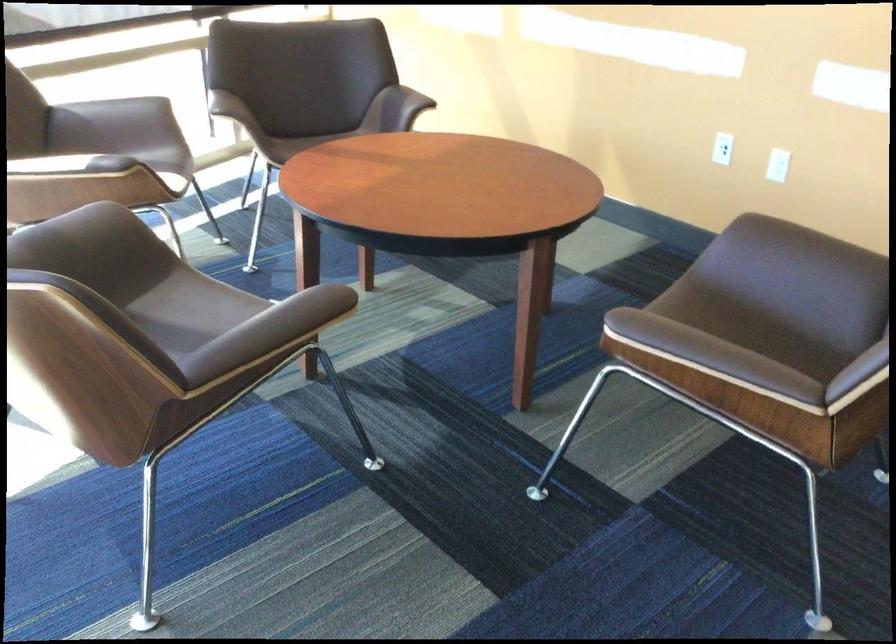
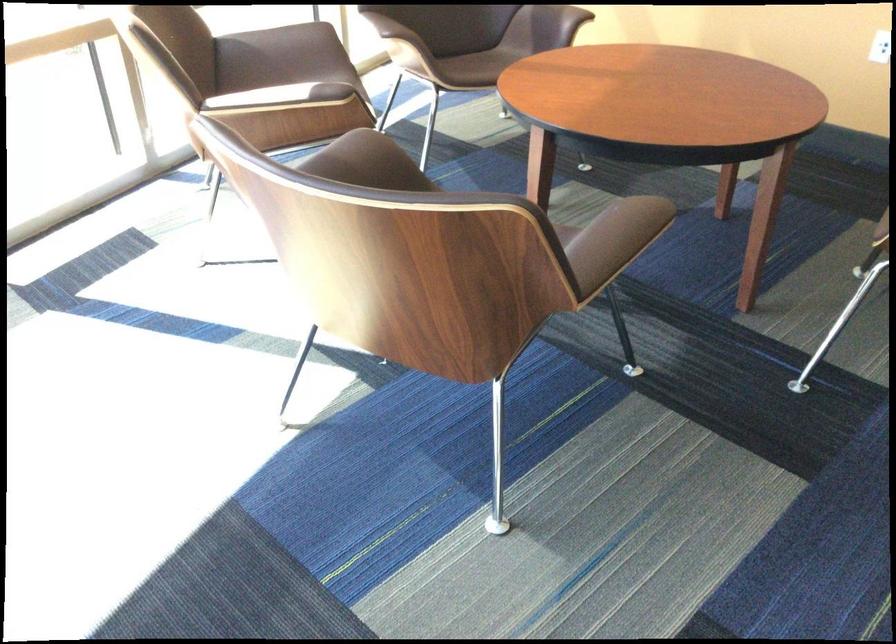
Locate, in the second image, the point that corresponds to pixel 118 125 in the first image.

(281, 55)